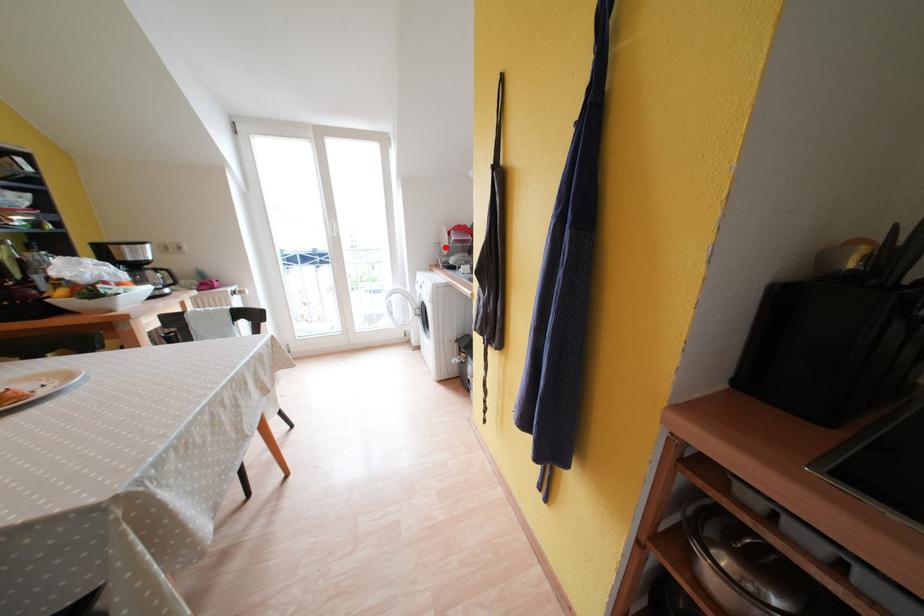
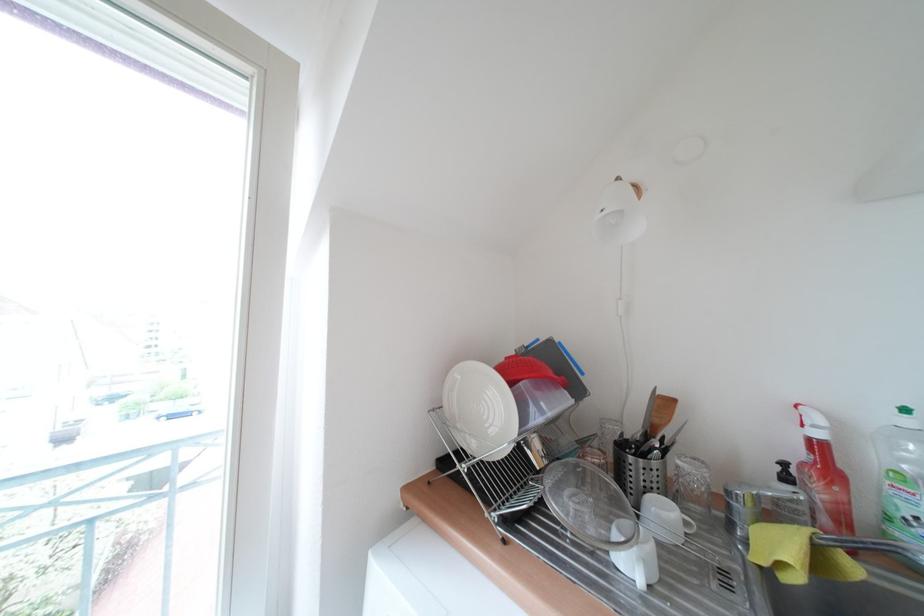
Question: I am providing you with two images of the same scene from different viewpoints. In image1, a red point is highlighted. Considering the same 3D point in image2, which of the following is correct?

Choices:
 (A) It is closer
 (B) It is farther

Answer: (B)